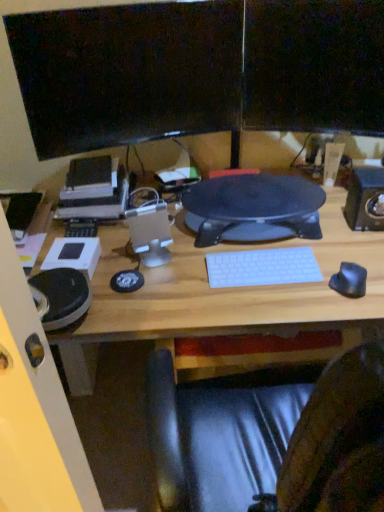
In order to click on vacant space situated on the left part of black rubber mouse at right in this screenshot , I will do `click(294, 306)`.